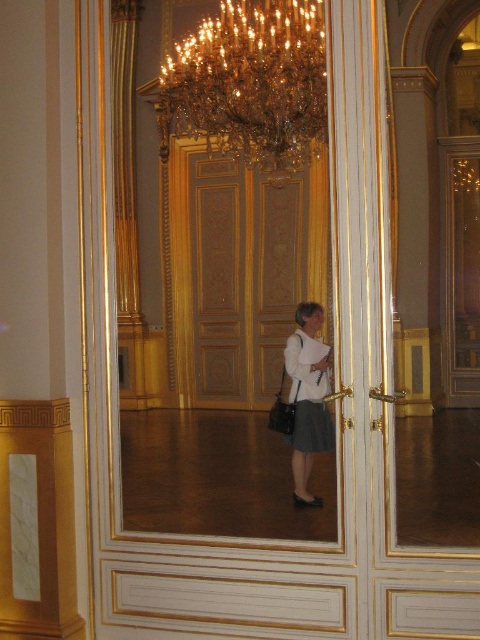
You are standing in the grand room and need to locate both the wooden paneling at center and the gold crystal chandelier at upper center. Based on their positions, which object is positioned to the left side of the other?

The wooden paneling at center is to the left of gold crystal chandelier at upper center, so the wooden paneling at center is positioned to the left side of the gold crystal chandelier at upper center.

You are an interior designer assessing the space. You need to determine which object occupies more area in the room between the wooden paneling at center and the gold crystal chandelier at upper center. Based on the scene, which one is larger?

The wooden paneling at center is larger in size than the gold crystal chandelier at upper center, so the wooden paneling at center occupies more area in the room.

You are standing in the grand room and see the wooden paneling at center and the white fabric blouse at center. Which object is positioned to the left of the other?

The wooden paneling at center is to the left of the white fabric blouse at center.